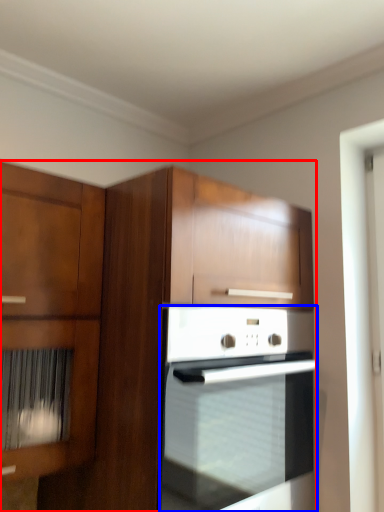
Question: Which object appears closest to the camera in this image, cabinetry (highlighted by a red box) or oven (highlighted by a blue box)?

Choices:
 (A) cabinetry
 (B) oven

Answer: (A)